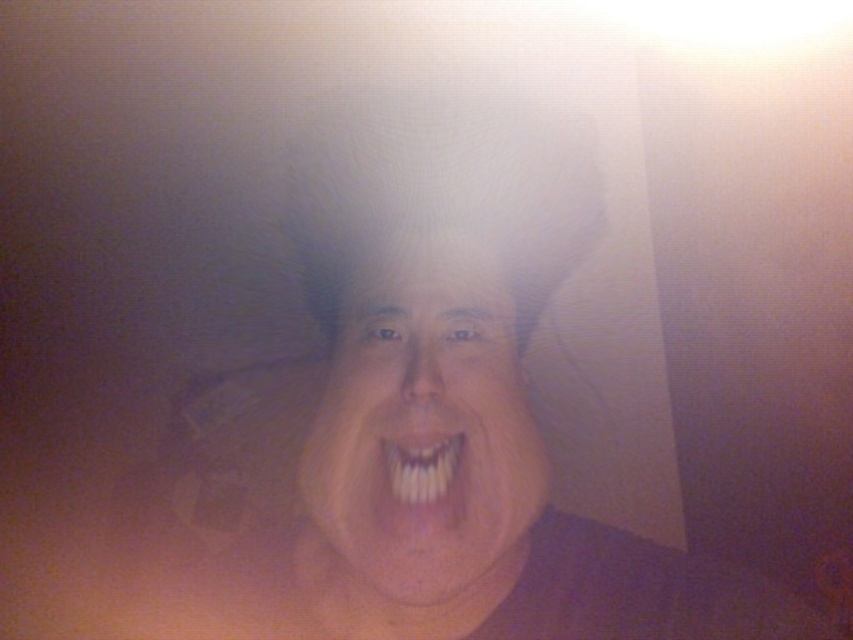
Question: Does white glossy face at center have a greater width compared to white glossy teeth at center?

Choices:
 (A) no
 (B) yes

Answer: (B)

Question: Is white glossy face at center above white glossy teeth at center?

Choices:
 (A) yes
 (B) no

Answer: (A)

Question: Which object is closer to the camera taking this photo?

Choices:
 (A) white glossy face at center
 (B) white glossy teeth at center

Answer: (A)

Question: Which of the following is the closest to the observer?

Choices:
 (A) (404, 456)
 (B) (355, 362)

Answer: (A)

Question: Considering the relative positions of white glossy face at center and white glossy teeth at center in the image provided, where is white glossy face at center located with respect to white glossy teeth at center?

Choices:
 (A) below
 (B) above

Answer: (B)

Question: Which object is closer to the camera taking this photo?

Choices:
 (A) white glossy face at center
 (B) white glossy teeth at center

Answer: (A)